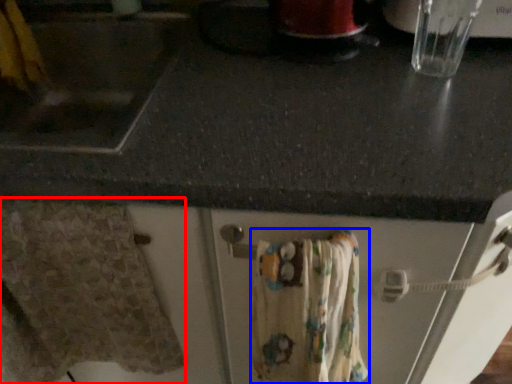
Question: Which of the following is the closest to the observer, bath towel (highlighted by a red box) or bath towel (highlighted by a blue box)?

Choices:
 (A) bath towel
 (B) bath towel

Answer: (B)